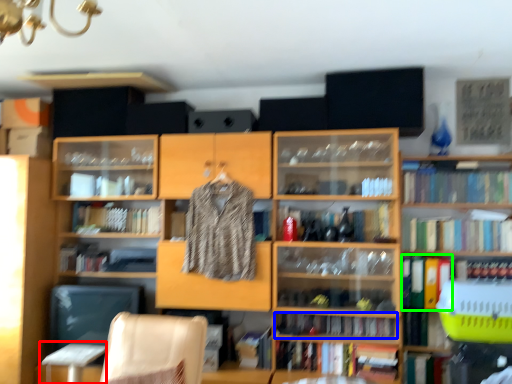
Question: Which object is positioned closest to table (highlighted by a red box)? Select from book (highlighted by a blue box) and book (highlighted by a green box).

Choices:
 (A) book
 (B) book

Answer: (A)